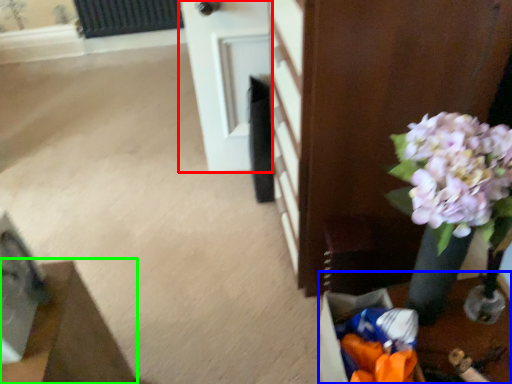
Question: Based on their relative distances, which object is farther from door (highlighted by a red box)? Choose from table (highlighted by a blue box) and furniture (highlighted by a green box).

Choices:
 (A) table
 (B) furniture

Answer: (B)